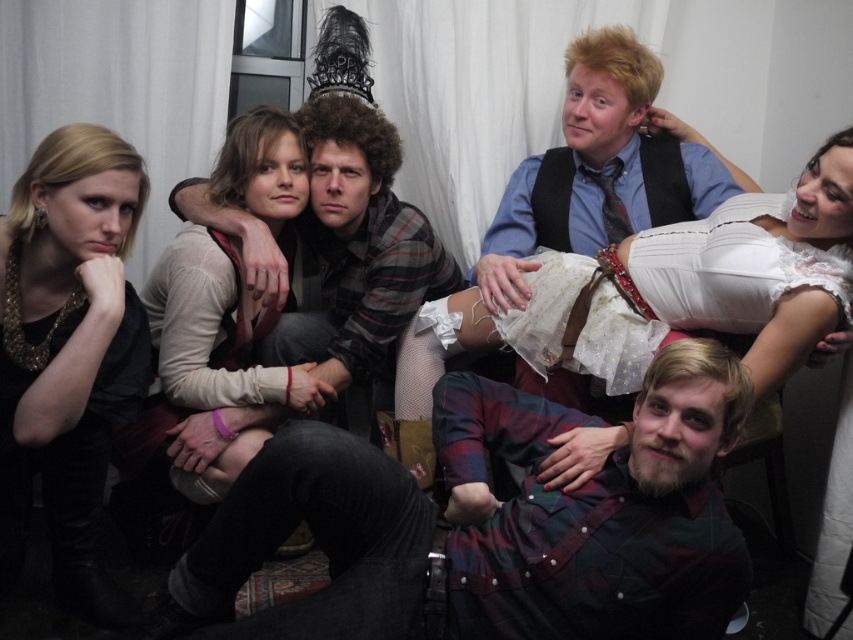
The image size is (853, 640). What do you see at coordinates (601, 168) in the screenshot?
I see `blue shirt at upper right` at bounding box center [601, 168].

Can you confirm if blue shirt at upper right is positioned to the right of plaid flannel shirt at center?

Yes, blue shirt at upper right is to the right of plaid flannel shirt at center.

Is point (502, 294) positioned in front of point (379, 248)?

Yes, point (502, 294) is closer to viewer.

Image resolution: width=853 pixels, height=640 pixels. Find the location of `blue shirt at upper right`. blue shirt at upper right is located at coordinates (601, 168).

Is flannel shirt at lower right closer to the viewer compared to matte black shirt at left?

Yes, it is in front of matte black shirt at left.

Locate an element on the screen. flannel shirt at lower right is located at coordinates (494, 534).

Is matte black shirt at left positioned before blue shirt at upper right?

Yes.

Describe the element at coordinates (68, 353) in the screenshot. I see `matte black shirt at left` at that location.

The image size is (853, 640). I want to click on matte black shirt at left, so click(68, 353).